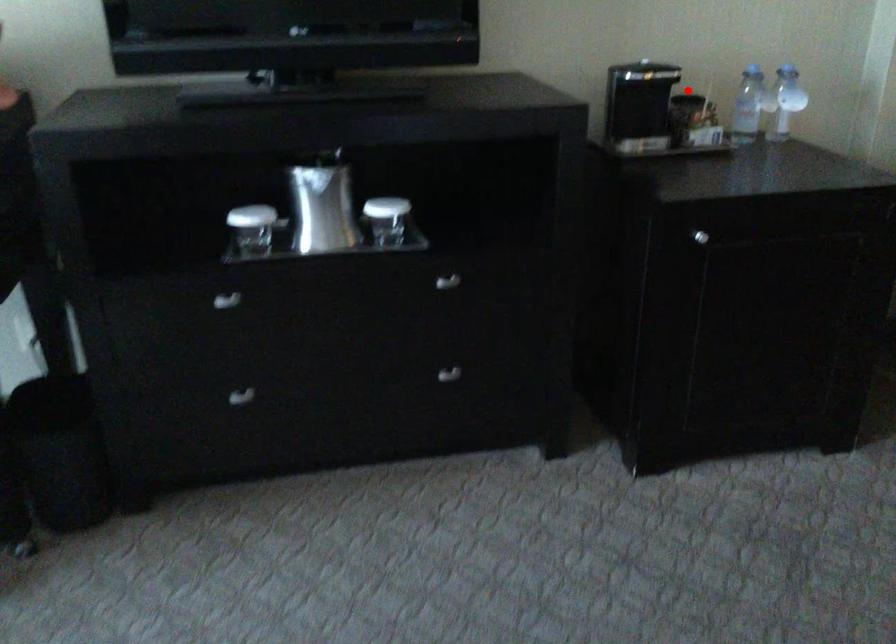
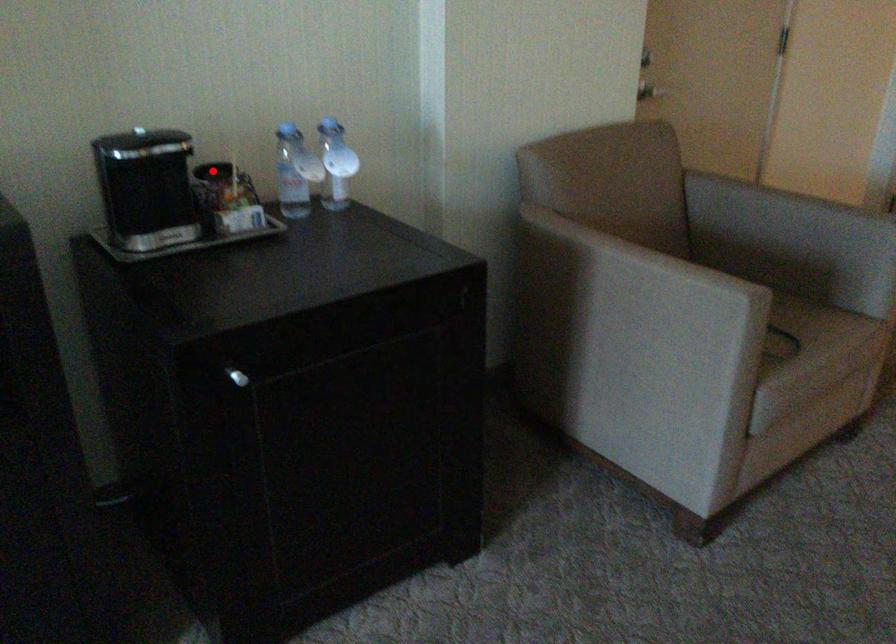
I am providing you with two images of the same scene from different viewpoints. A red point is marked on the first image and another point is marked on the second image. Are the points marked in image1 and image2 representing the same 3D position?

Yes